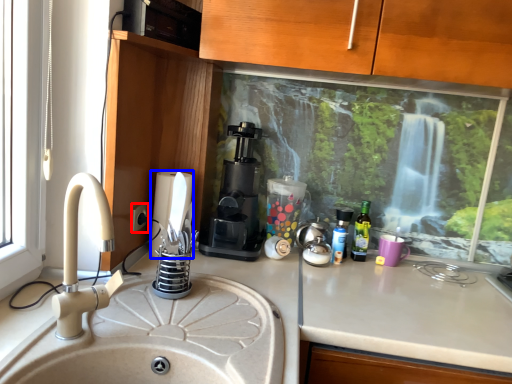
Question: Which object appears farthest to the camera in this image, electric outlet (highlighted by a red box) or appliance (highlighted by a blue box)?

Choices:
 (A) electric outlet
 (B) appliance

Answer: (B)